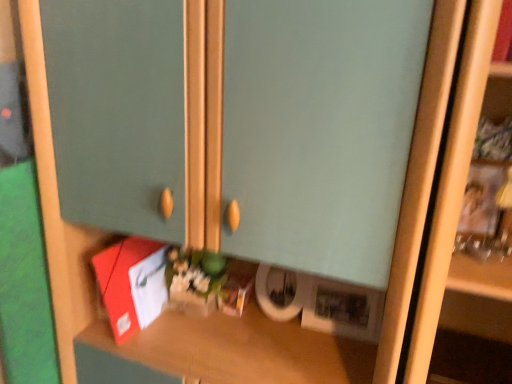
This screenshot has width=512, height=384. I want to click on matte red book at lower left, so click(x=131, y=284).

Image resolution: width=512 pixels, height=384 pixels. What do you see at coordinates (131, 284) in the screenshot? I see `matte red book at lower left` at bounding box center [131, 284].

The height and width of the screenshot is (384, 512). What are the coordinates of `matte red book at lower left` in the screenshot? It's located at (131, 284).